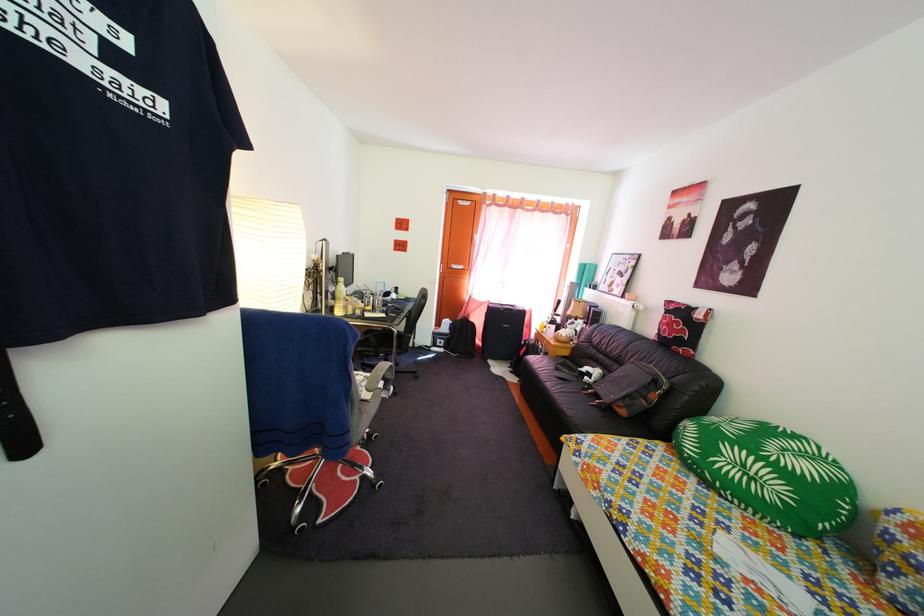
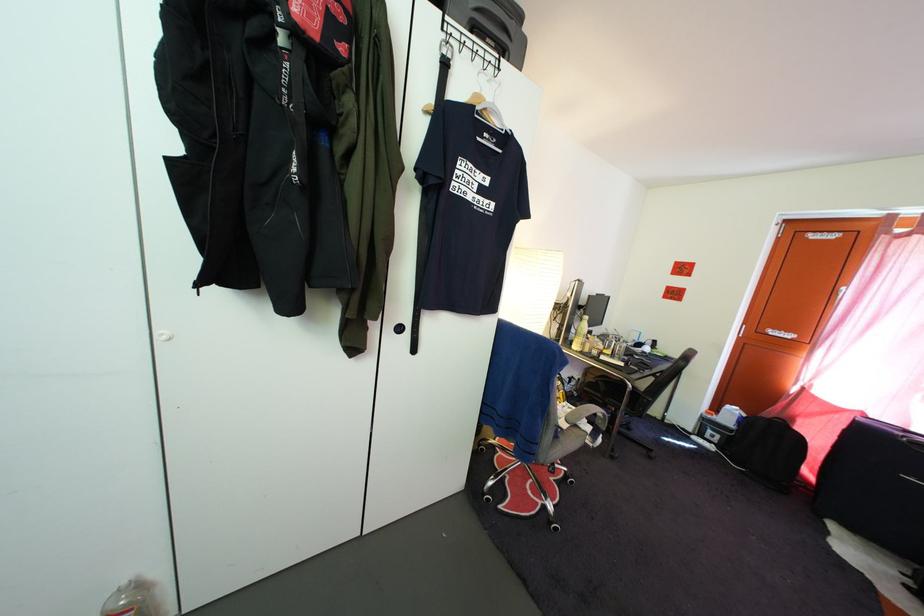
Where in the second image is the point corresponding to pixel 487 350 from the first image?

(817, 483)